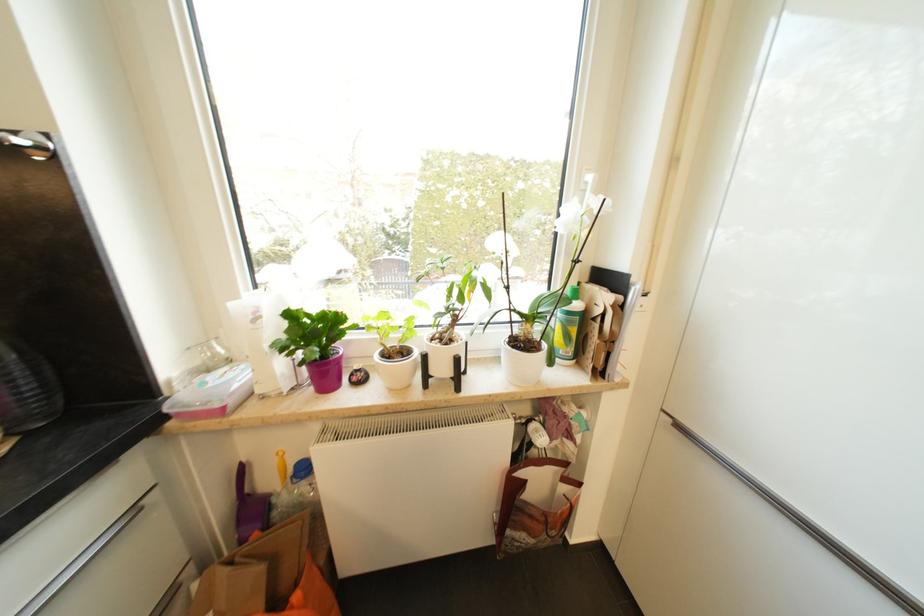
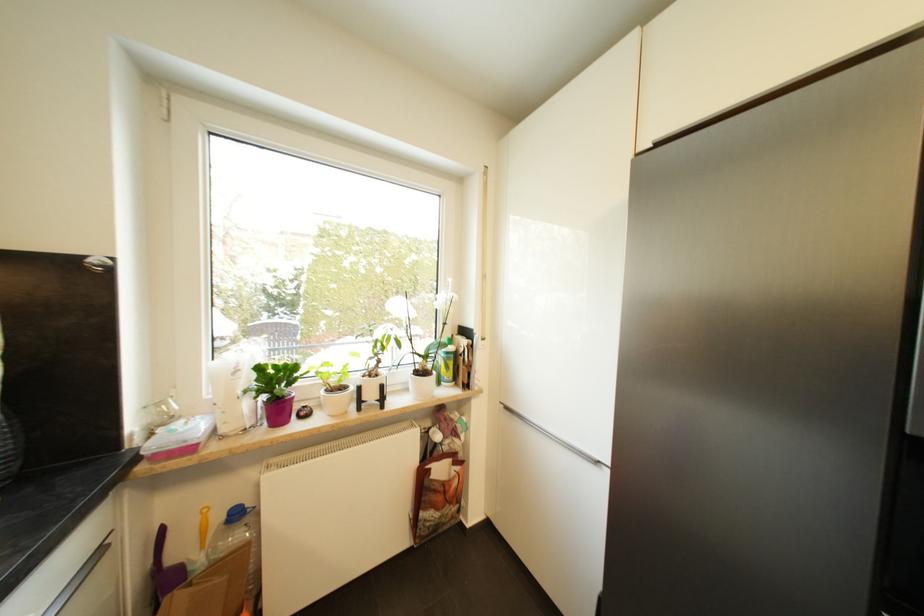
In the second image, find the point that corresponds to (330,374) in the first image.

(285, 411)